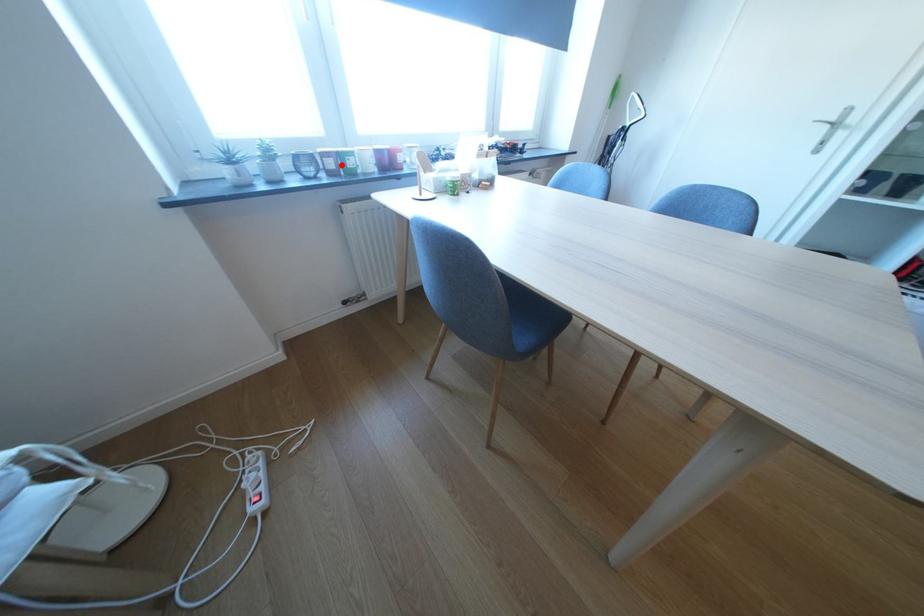
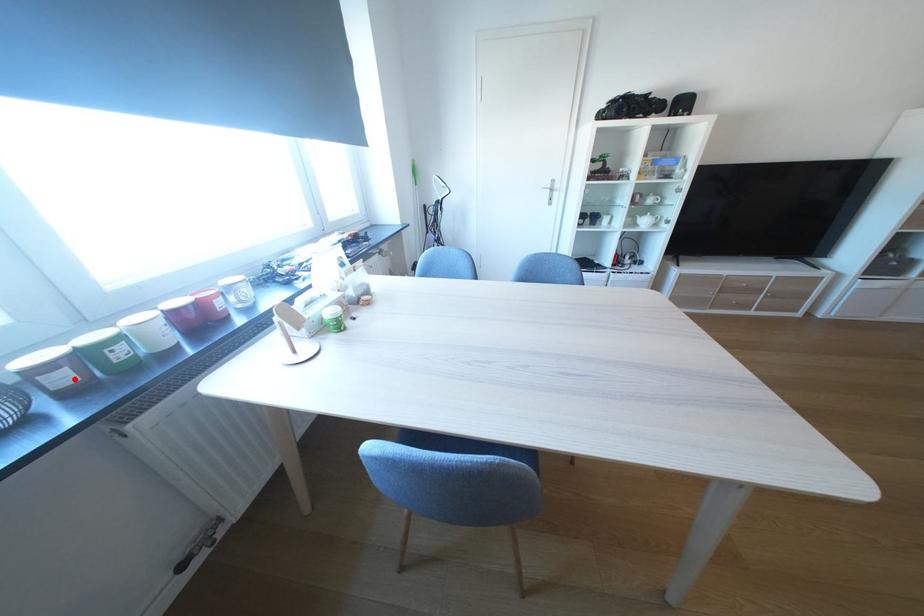
I am providing you with two images of the same scene from different viewpoints. A red point is marked on the first image and another point is marked on the second image. Is the red point in image1 aligned with the point shown in image2?

Yes